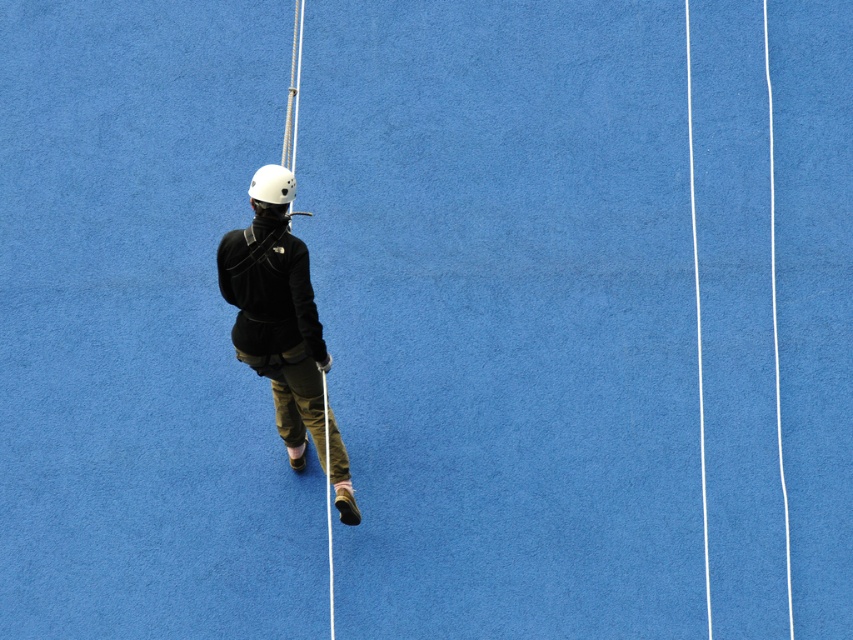
Question: Considering the relative positions of matte black jacket at center and white matte helmet at center in the image provided, where is matte black jacket at center located with respect to white matte helmet at center?

Choices:
 (A) below
 (B) above

Answer: (A)

Question: Which point is closer to the camera?

Choices:
 (A) (225, 284)
 (B) (329, 636)
 (C) (279, 172)

Answer: (C)

Question: Is white matte helmet at center smaller than matte black ski pole at center?

Choices:
 (A) yes
 (B) no

Answer: (A)

Question: Does matte black jacket at center appear under matte black ski pole at center?

Choices:
 (A) yes
 (B) no

Answer: (B)

Question: Which of the following is the closest to the observer?

Choices:
 (A) (328, 449)
 (B) (257, 189)

Answer: (B)

Question: Which point appears closest to the camera in this image?

Choices:
 (A) (329, 632)
 (B) (276, 182)
 (C) (296, 285)

Answer: (B)